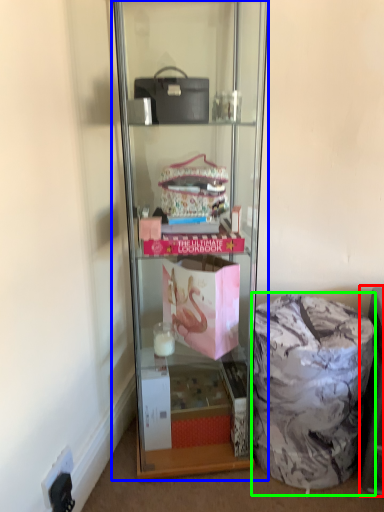
Question: Which object is the closest to the cabinet (highlighted by a red box)? Choose among these: shelf (highlighted by a blue box) or garbage (highlighted by a green box).

Choices:
 (A) shelf
 (B) garbage

Answer: (B)